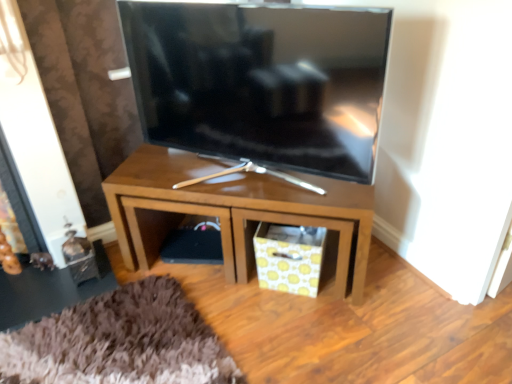
At what (x,y) coordinates should I click in order to perform the action: click on free location in front of shiny metallic side table at lower left. Please return your answer as a coordinate pair (x, y). Looking at the image, I should click on (58, 349).